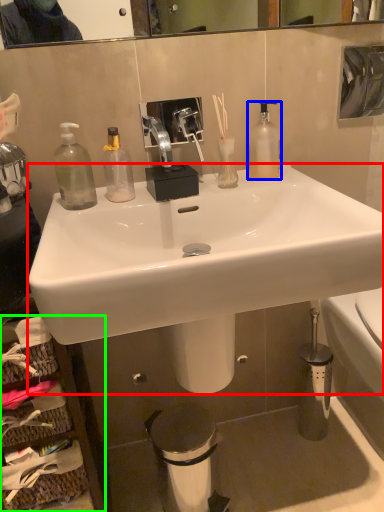
Question: Based on their relative distances, which object is nearer to sink (highlighted by a red box)? Choose from bottle (highlighted by a blue box) and cabinetry (highlighted by a green box).

Choices:
 (A) bottle
 (B) cabinetry

Answer: (A)